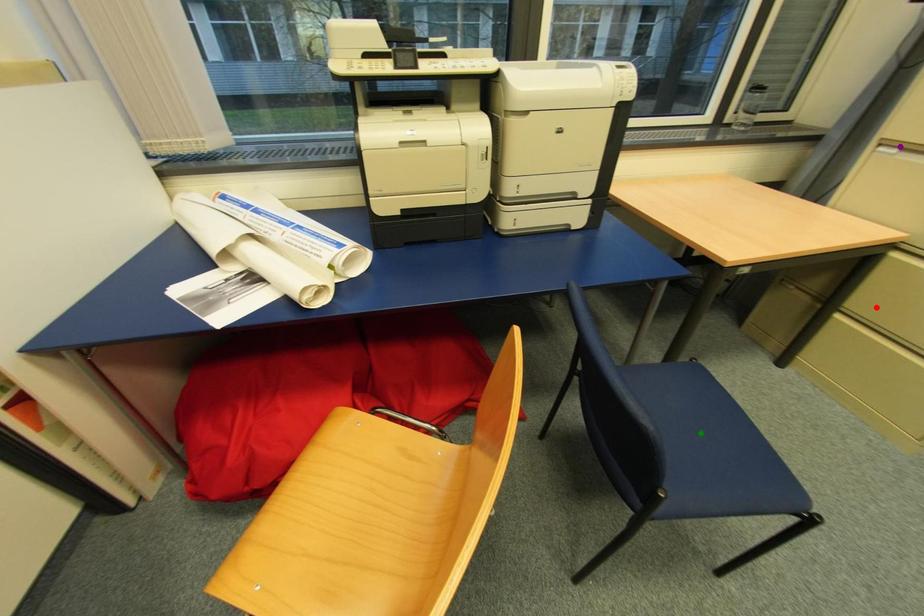
Order these from nearest to farthest:
red point, green point, purple point

1. purple point
2. green point
3. red point